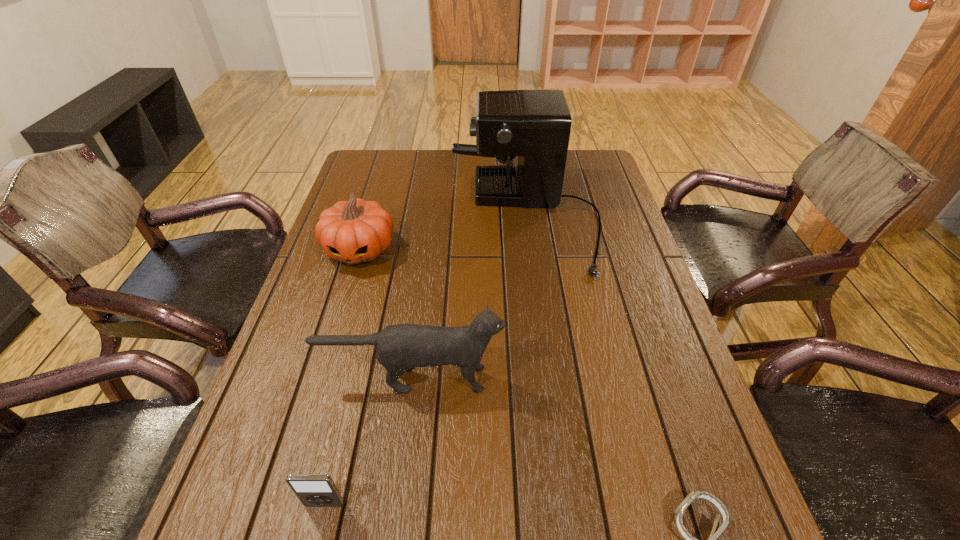
Find the location of `object located at the far edge`. object located at the far edge is located at coordinates (535, 124).

Locate an element on the screen. cat present at the left edge is located at coordinates (400, 348).

Locate an element on the screen. The width and height of the screenshot is (960, 540). pumpkin that is at the left edge is located at coordinates point(355,231).

At what (x,y) coordinates should I click in order to perform the action: click on iPod that is at the left edge. Please return your answer as a coordinate pair (x, y). The height and width of the screenshot is (540, 960). Looking at the image, I should click on (313, 490).

Where is `object that is positioned at the right edge`? The width and height of the screenshot is (960, 540). object that is positioned at the right edge is located at coordinates (535, 124).

Image resolution: width=960 pixels, height=540 pixels. In order to click on object situated at the far right corner in this screenshot , I will do `click(535, 124)`.

In the image, there is a desktop. In order to click on vacant space at the far edge in this screenshot , I will do `click(426, 155)`.

Locate an element on the screen. vacant space at the left edge of the desktop is located at coordinates (362, 283).

Where is `blank space at the right edge of the desktop`? The image size is (960, 540). blank space at the right edge of the desktop is located at coordinates (622, 299).

Locate an element on the screen. free space that is in between the second tallest object and the fourth tallest object is located at coordinates (369, 441).